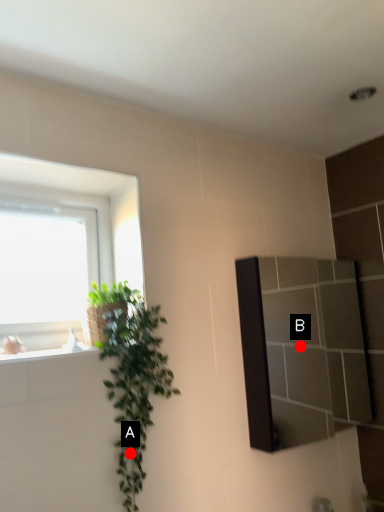
Question: Two points are circled on the image, labeled by A and B beside each circle. Which point is farther from the camera taking this photo?

Choices:
 (A) A is further
 (B) B is further

Answer: (B)